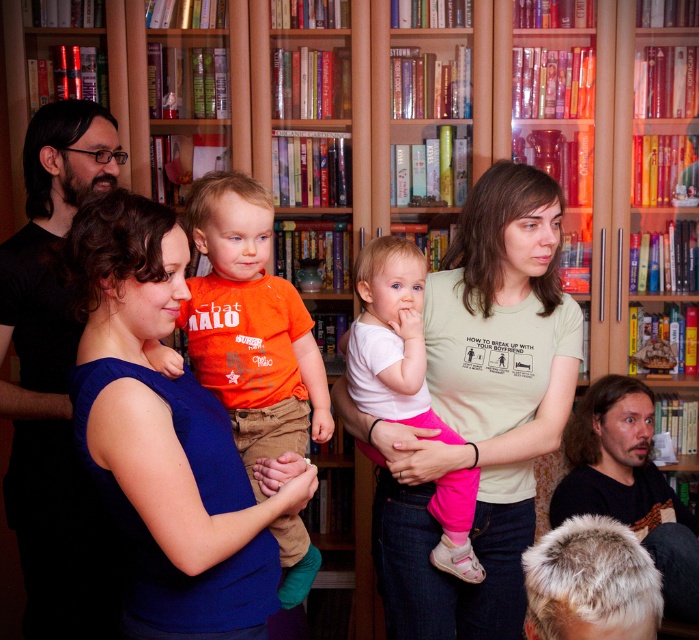
Question: Which point is closer to the camera taking this photo?

Choices:
 (A) (489, 412)
 (B) (24, 465)

Answer: (A)

Question: Does light green t-shirt at center have a lesser width compared to orange cotton shirt at center?

Choices:
 (A) no
 (B) yes

Answer: (A)

Question: Based on their relative distances, which object is farther from the orange cotton shirt at center?

Choices:
 (A) white cotton shirt at center
 (B) dark brown hair at lower right

Answer: (B)

Question: Which point is farther from the camera taking this photo?

Choices:
 (A) (336, 396)
 (B) (440, 518)

Answer: (A)

Question: Is orange cotton shirt at center positioned before dark brown hair at lower right?

Choices:
 (A) yes
 (B) no

Answer: (A)

Question: Is dark brown hair at lower right thinner than white cotton shirt at center?

Choices:
 (A) yes
 (B) no

Answer: (B)